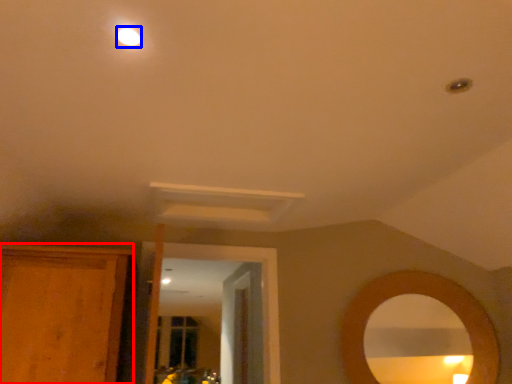
Question: Which object appears farthest to the camera in this image, cabinetry (highlighted by a red box) or lighting (highlighted by a blue box)?

Choices:
 (A) cabinetry
 (B) lighting

Answer: (A)